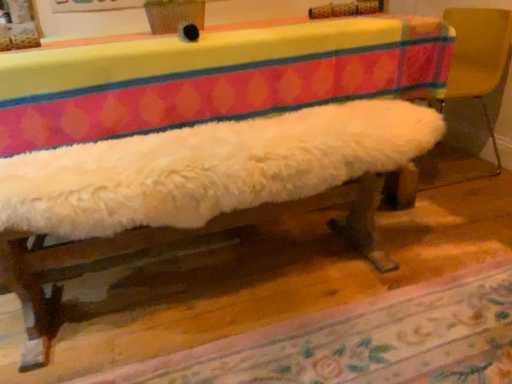
Identify the location of vacant space behind floral carpet at lower center. Image resolution: width=512 pixels, height=384 pixels. (337, 255).